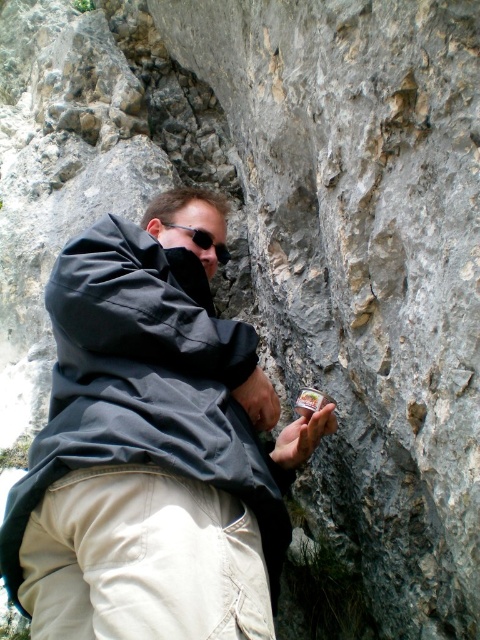
Is khaki cotton pants at lower left to the left of black matte sunglasses at center from the viewer's perspective?

Correct, you'll find khaki cotton pants at lower left to the left of black matte sunglasses at center.

Is the position of khaki cotton pants at lower left more distant than that of black matte sunglasses at center?

No, it is in front of black matte sunglasses at center.

You are a GUI agent. You are given a task and a screenshot of the screen. Output one action in this format:
    pyautogui.click(x=<x>, y=<y>)
    Task: Click on the khaki cotton pants at lower left
    Image resolution: width=480 pixels, height=640 pixels.
    Given the screenshot: What is the action you would take?
    pyautogui.click(x=143, y=561)

Who is lower down, dark gray fabric at center or khaki cotton pants at lower left?

khaki cotton pants at lower left is lower down.

Is dark gray fabric at center above khaki cotton pants at lower left?

Yes.

Between point (184, 296) and point (157, 497), which one is positioned behind?

Positioned behind is point (184, 296).

Where is `dark gray fabric at center`? This screenshot has height=640, width=480. dark gray fabric at center is located at coordinates (153, 448).

Is dark gray fabric at center above black matte sunglasses at center?

No.

Between dark gray fabric at center and black matte sunglasses at center, which one appears on the left side from the viewer's perspective?

From the viewer's perspective, dark gray fabric at center appears more on the left side.

You are a GUI agent. You are given a task and a screenshot of the screen. Output one action in this format:
    pyautogui.click(x=<x>, y=<y>)
    Task: Click on the dark gray fabric at center
    The height and width of the screenshot is (640, 480).
    Given the screenshot: What is the action you would take?
    pyautogui.click(x=153, y=448)